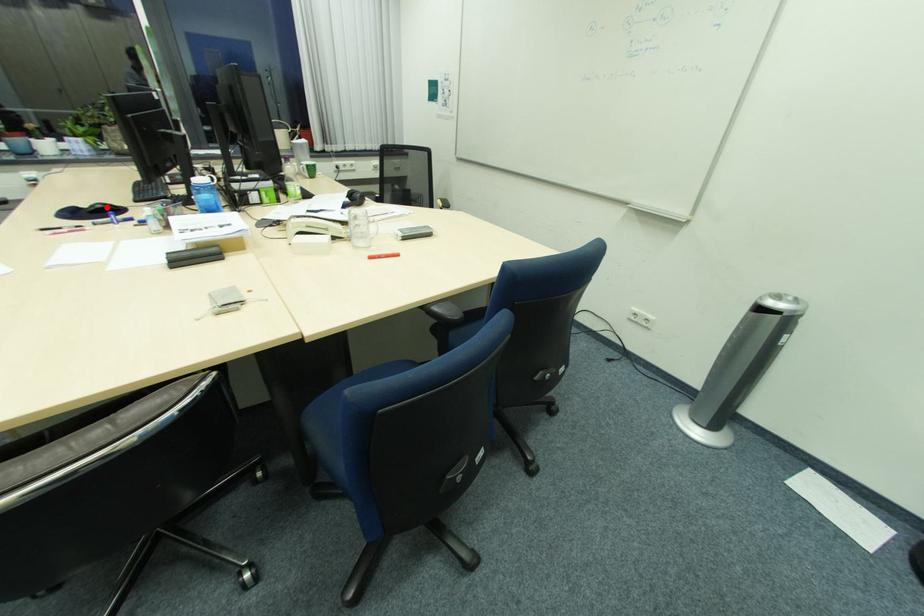
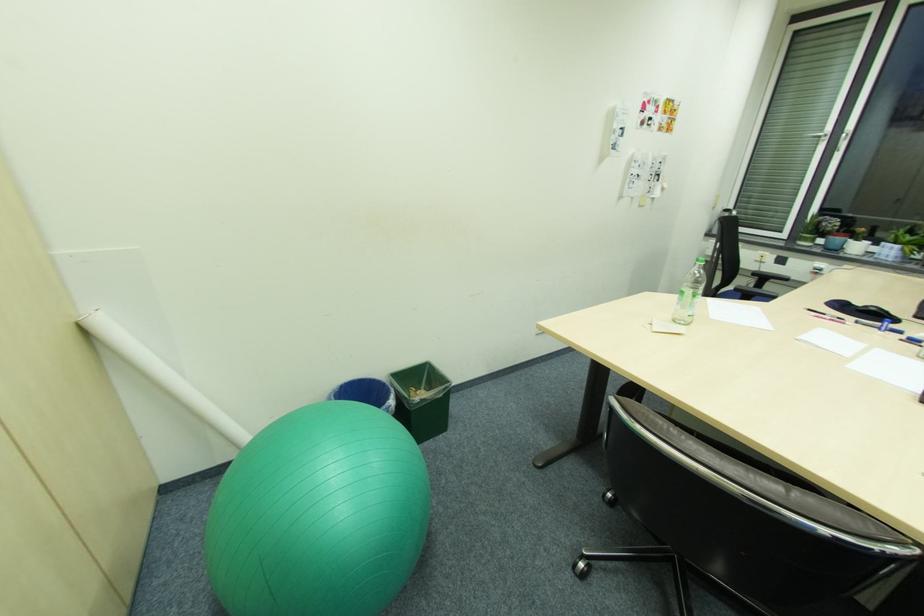
Find the pixel in the second image that matches the highlighted location in the first image.

(879, 310)